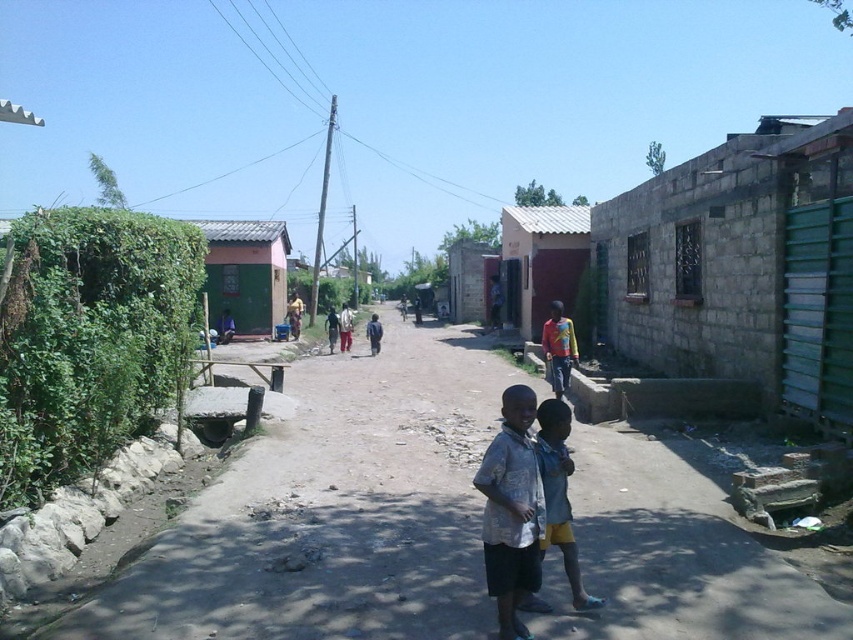
You are standing on the rural street scene looking at two points marked in the image. Which point, point (x=505, y=609) or point (x=544, y=451), is nearer to you?

Point (x=505, y=609) is closer to the camera than point (x=544, y=451), so the point (x=505, y=609) is nearer to you.